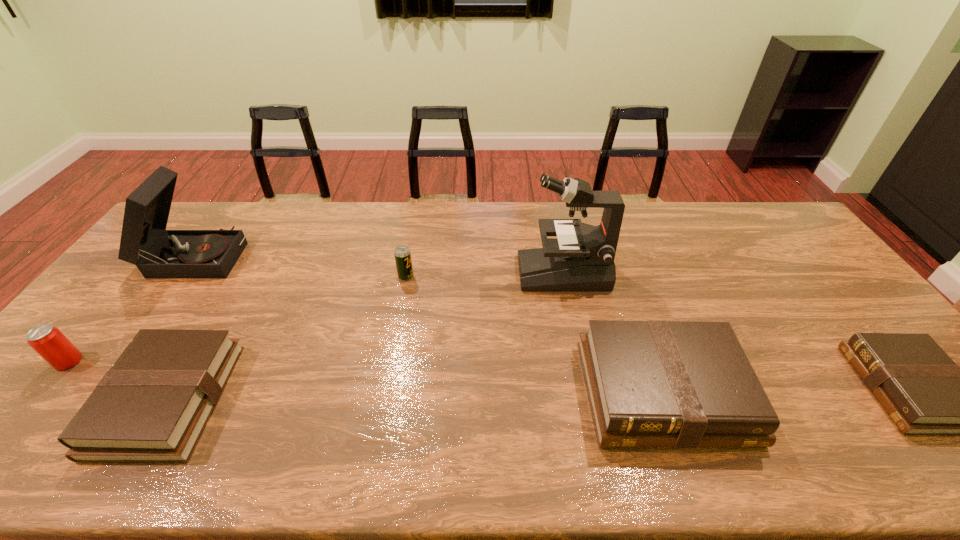
Where is `vacant space located on the front-facing side of the phonograph_record`? The image size is (960, 540). vacant space located on the front-facing side of the phonograph_record is located at coordinates (271, 255).

Where is `vacant space situated 0.110m through the eyepieces of the microscope`? The height and width of the screenshot is (540, 960). vacant space situated 0.110m through the eyepieces of the microscope is located at coordinates (485, 272).

Where is `vacant space located 0.290m through the eyepieces of the microscope`? The height and width of the screenshot is (540, 960). vacant space located 0.290m through the eyepieces of the microscope is located at coordinates (427, 272).

Locate an element on the screen. vacant position located 0.260m through the eyepieces of the microscope is located at coordinates (437, 272).

Image resolution: width=960 pixels, height=540 pixels. I want to click on vacant area located 0.400m on the right of the can, so click(x=235, y=361).

The image size is (960, 540). In order to click on vacant area located 0.210m on the left of the fourth object from left to right in this screenshot , I will do `click(331, 276)`.

The height and width of the screenshot is (540, 960). I want to click on object located in the far edge section of the desktop, so click(158, 253).

The image size is (960, 540). Identify the location of phonograph_record that is at the left edge. (158, 253).

The height and width of the screenshot is (540, 960). I want to click on can situated at the left edge, so [49, 342].

Where is `object that is at the far left corner`? This screenshot has height=540, width=960. object that is at the far left corner is located at coordinates (158, 253).